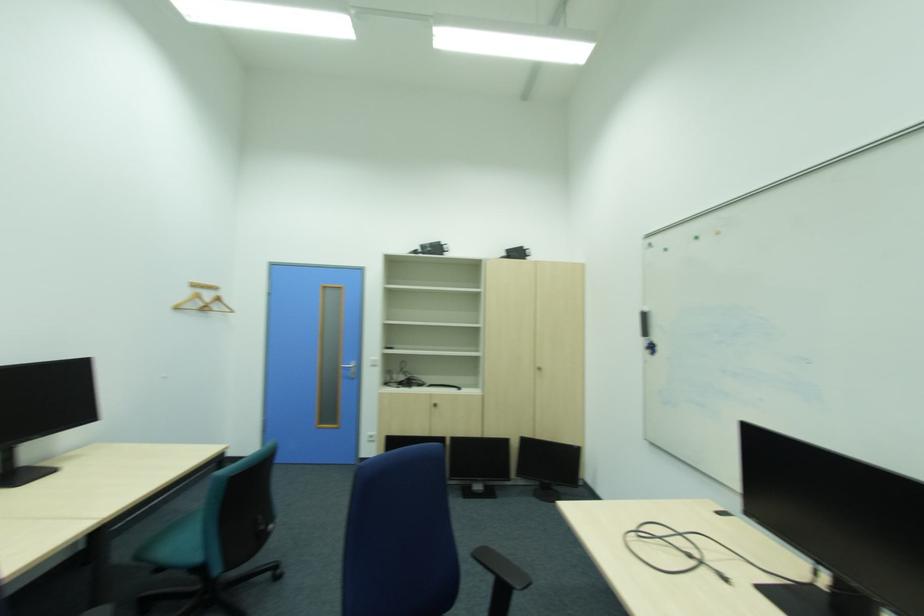
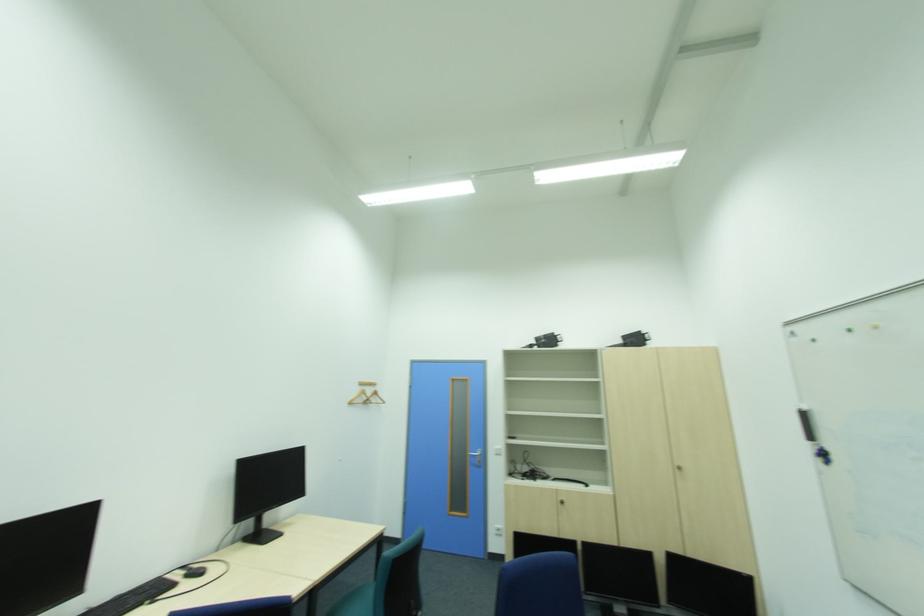
Question: Which direction would the cameraman need to move to produce the second image? Reply with the corresponding letter.

Choices:
 (A) Left
 (B) Right
 (C) Forward
 (D) Backward

Answer: (D)